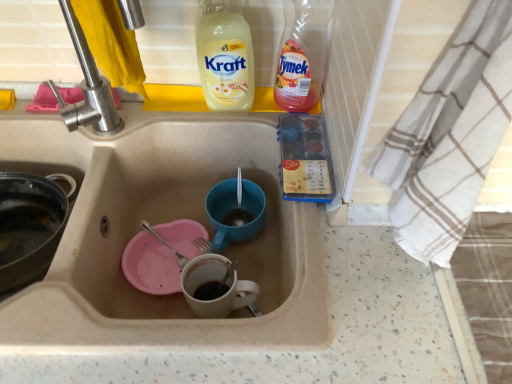
Question: Considering the relative sizes of translucent plastic bottle at upper right and blue matte cup at center in the image provided, is translucent plastic bottle at upper right bigger than blue matte cup at center?

Choices:
 (A) yes
 (B) no

Answer: (A)

Question: From the image's perspective, is translucent plastic bottle at upper right below blue matte cup at center?

Choices:
 (A) yes
 (B) no

Answer: (B)

Question: From a real-world perspective, is translucent plastic bottle at upper right over blue matte cup at center?

Choices:
 (A) yes
 (B) no

Answer: (A)

Question: Is translucent plastic bottle at upper right positioned with its back to blue matte cup at center?

Choices:
 (A) no
 (B) yes

Answer: (A)

Question: Considering the relative sizes of translucent plastic bottle at upper right and blue matte cup at center in the image provided, is translucent plastic bottle at upper right smaller than blue matte cup at center?

Choices:
 (A) no
 (B) yes

Answer: (A)

Question: Is blue matte cup at center taller or shorter than white cotton towel at right?

Choices:
 (A) short
 (B) tall

Answer: (A)

Question: Is blue matte cup at center in front of or behind white cotton towel at right in the image?

Choices:
 (A) behind
 (B) front

Answer: (A)

Question: Is blue matte cup at center to the left or to the right of white cotton towel at right in the image?

Choices:
 (A) right
 (B) left

Answer: (B)

Question: From a real-world perspective, is blue matte cup at center above or below white cotton towel at right?

Choices:
 (A) above
 (B) below

Answer: (B)

Question: From a real-world perspective, is blue matte cup at center positioned above or below beige ceramic sink at center?

Choices:
 (A) below
 (B) above

Answer: (A)

Question: In terms of height, does blue matte cup at center look taller or shorter compared to beige ceramic sink at center?

Choices:
 (A) short
 (B) tall

Answer: (A)

Question: From the image's perspective, is blue matte cup at center above or below beige ceramic sink at center?

Choices:
 (A) above
 (B) below

Answer: (A)

Question: In the image, is blue matte cup at center positioned in front of or behind beige ceramic sink at center?

Choices:
 (A) front
 (B) behind

Answer: (B)

Question: Considering the positions of satin nickel faucet at upper left and translucent plastic bottle at upper right in the image, is satin nickel faucet at upper left taller or shorter than translucent plastic bottle at upper right?

Choices:
 (A) tall
 (B) short

Answer: (B)

Question: From a real-world perspective, relative to translucent plastic bottle at upper right, is satin nickel faucet at upper left vertically above or below?

Choices:
 (A) below
 (B) above

Answer: (B)